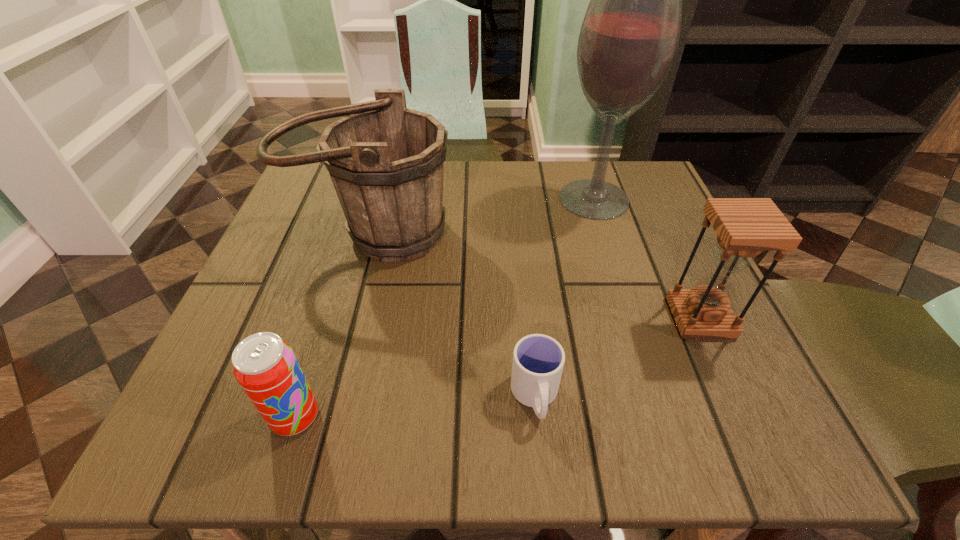
Where is `vacant area located on the right of the fourth tallest object`? The width and height of the screenshot is (960, 540). vacant area located on the right of the fourth tallest object is located at coordinates (398, 417).

Image resolution: width=960 pixels, height=540 pixels. Identify the location of alcohol at the far edge. (629, 37).

Where is `bucket present at the far edge`? The width and height of the screenshot is (960, 540). bucket present at the far edge is located at coordinates (386, 162).

Locate an element on the screen. soda can that is positioned at the near edge is located at coordinates (265, 366).

Locate an element on the screen. cup located in the near edge section of the desktop is located at coordinates pos(538,360).

You are a GUI agent. You are given a task and a screenshot of the screen. Output one action in this format:
    pyautogui.click(x=<x>, y=<y>)
    Task: Click on the bucket located at the left edge
    This screenshot has height=540, width=960.
    Given the screenshot: What is the action you would take?
    pyautogui.click(x=386, y=162)

Image resolution: width=960 pixels, height=540 pixels. Identify the location of soda can situated at the left edge. (265, 366).

Where is `alcohol located at the right edge`? alcohol located at the right edge is located at coordinates (629, 37).

Find the location of a particular element. Image resolution: width=960 pixels, height=540 pixels. hourglass that is at the right edge is located at coordinates (745, 227).

Identify the location of object present at the far left corner. [x=386, y=162].